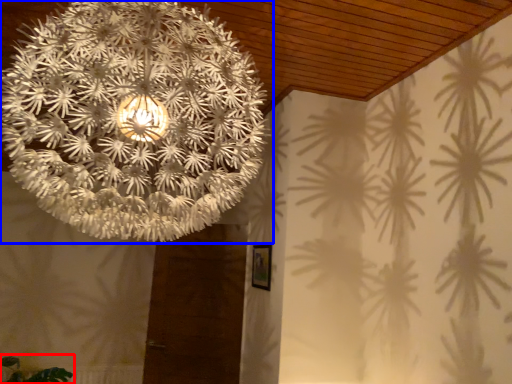
Question: Which object is closer to the camera taking this photo, plant (highlighted by a red box) or lamp (highlighted by a blue box)?

Choices:
 (A) plant
 (B) lamp

Answer: (B)